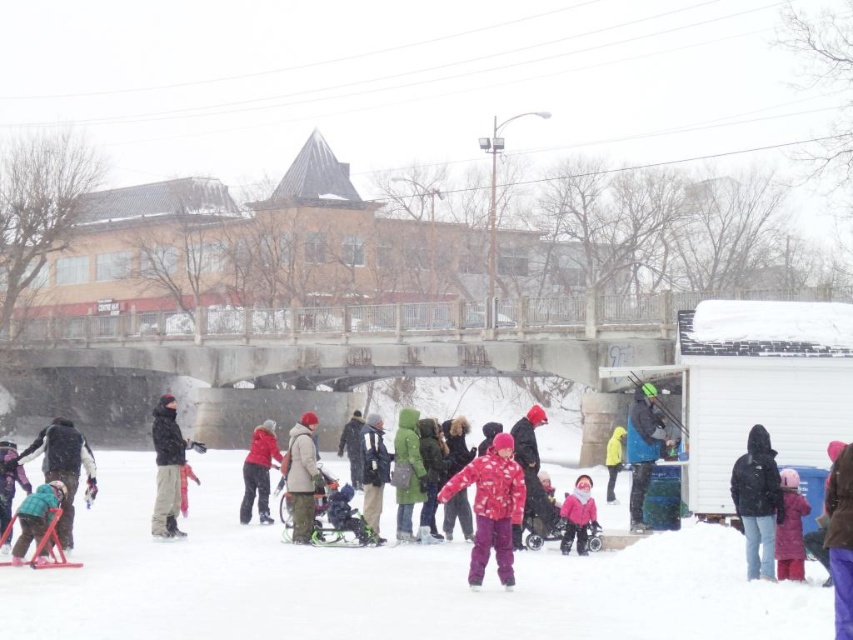
Looking at this image, which of these two, white fluffy snow at center or green matte jacket at center, stands taller?

green matte jacket at center is taller.

Which is in front, point (635, 608) or point (396, 508)?

Point (635, 608) is in front.

Does point (265, 593) lie behind point (416, 444)?

No, it is in front of (416, 444).

I want to click on white fluffy snow at center, so click(383, 580).

Can you confirm if matte black jacket at left is positioned to the right of matte beige coat at center?

In fact, matte black jacket at left is to the left of matte beige coat at center.

Which is in front, point (167, 400) or point (311, 529)?

Point (311, 529) is in front.

Which is in front, point (161, 476) or point (311, 452)?

Point (161, 476)

Find the location of a particular element. The image size is (853, 640). matte black jacket at left is located at coordinates pyautogui.click(x=167, y=467).

Between brown fuzzy coat at lower right and brushed metal snowboard at lower left, which one has less height?

Standing shorter between the two is brown fuzzy coat at lower right.

Is point (833, 577) positioned after point (62, 429)?

That is False.

Identify the location of brown fuzzy coat at lower right. (840, 540).